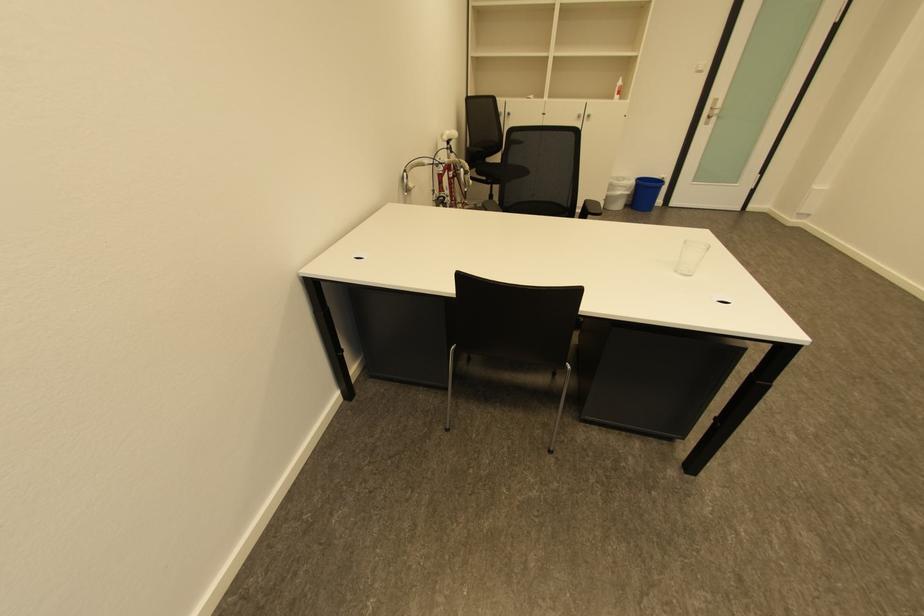
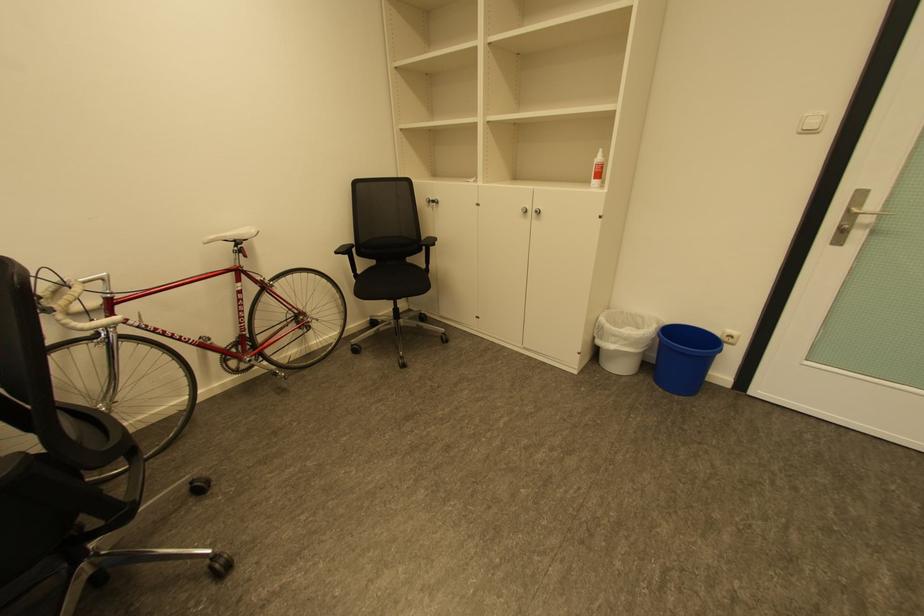
Locate, in the second image, the point that corresponds to (x=670, y=179) in the first image.

(737, 337)